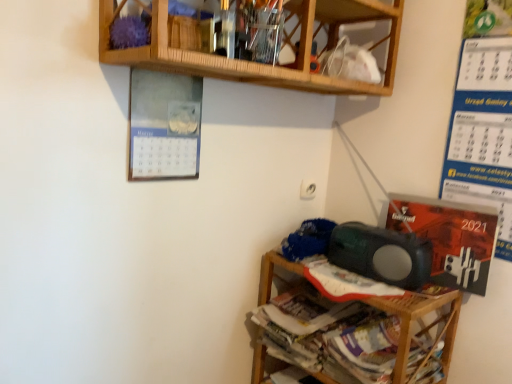
Question: Can you confirm if wooden at upper center, arranged as the 1th shelf when viewed from the top, is taller than blue paper calendar at right, which appears as the second writing when ordered from the bottom?

Choices:
 (A) no
 (B) yes

Answer: (A)

Question: Is wooden at upper center, arranged as the 1th shelf when viewed from the top, not within blue paper calendar at right, which appears as the second writing when ordered from the bottom?

Choices:
 (A) no
 (B) yes

Answer: (B)

Question: Can blue paper calendar at right, which is the 1th writing from top to bottom, be found inside wooden at upper center, which is the second shelf in bottom-to-top order?

Choices:
 (A) no
 (B) yes

Answer: (A)

Question: From a real-world perspective, does wooden at upper center, which is the second shelf in bottom-to-top order, stand above blue paper calendar at right, which appears as the second writing when ordered from the bottom?

Choices:
 (A) yes
 (B) no

Answer: (A)

Question: Is there a large distance between wooden at upper center, which is the second shelf in bottom-to-top order, and blue paper calendar at right, which appears as the second writing when ordered from the bottom?

Choices:
 (A) no
 (B) yes

Answer: (A)

Question: Does wooden at upper center, arranged as the 1th shelf when viewed from the top, come behind blue paper calendar at right, which is the 1th writing from top to bottom?

Choices:
 (A) no
 (B) yes

Answer: (A)

Question: Is blue knitted fabric at lower right touching orange glossy calendar at lower right, the first writing in the bottom-to-top sequence?

Choices:
 (A) no
 (B) yes

Answer: (A)

Question: Does blue knitted fabric at lower right appear on the right side of orange glossy calendar at lower right, the 2th writing in the top-to-bottom sequence?

Choices:
 (A) no
 (B) yes

Answer: (A)

Question: Is blue knitted fabric at lower right outside of orange glossy calendar at lower right, the first writing in the bottom-to-top sequence?

Choices:
 (A) no
 (B) yes

Answer: (B)

Question: From a real-world perspective, is blue knitted fabric at lower right beneath orange glossy calendar at lower right, the first writing in the bottom-to-top sequence?

Choices:
 (A) no
 (B) yes

Answer: (B)

Question: Is the depth of blue knitted fabric at lower right greater than that of orange glossy calendar at lower right, the 2th writing in the top-to-bottom sequence?

Choices:
 (A) yes
 (B) no

Answer: (A)

Question: Could orange glossy calendar at lower right, the first writing in the bottom-to-top sequence, be considered to be inside blue knitted fabric at lower right?

Choices:
 (A) no
 (B) yes

Answer: (A)

Question: Could you tell me if matte green speaker at lower right is facing wooden shelf at lower right, which ranks as the 1th shelf in bottom-to-top order?

Choices:
 (A) no
 (B) yes

Answer: (A)